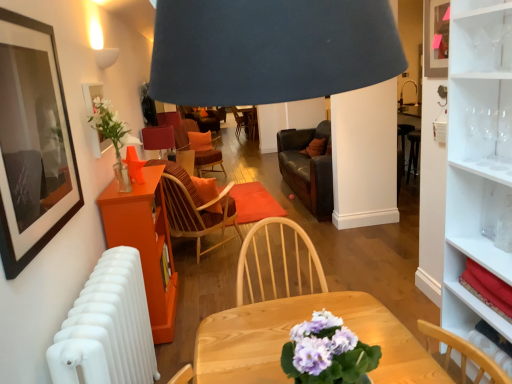
Question: Considering the positions of white matte radiator at lower left and matte red table lamp at center in the image, is white matte radiator at lower left wider or thinner than matte red table lamp at center?

Choices:
 (A) thin
 (B) wide

Answer: (A)

Question: Based on their sizes in the image, would you say white matte radiator at lower left is bigger or smaller than matte red table lamp at center?

Choices:
 (A) small
 (B) big

Answer: (B)

Question: Estimate the real-world distances between objects in this image. Which object is farther from the matte black picture frame at upper left, positioned as the 1th picture frame in front-to-back order?

Choices:
 (A) clear glass wine glass at upper right, acting as the first wine glass starting from the right
 (B) brown striped fabric chair at center, the first chair in the front-to-back sequence
 (C) matte glass picture frame at upper left, arranged as the first picture frame when viewed from the back
 (D) clear glass wine glass at upper right, marked as the first wine glass in a left-to-right arrangement
 (E) matte red table lamp at center

Answer: (E)

Question: Which object is positioned closest to the orange fabric chair at center, which appears as the 2th chair when viewed from the front?

Choices:
 (A) white matte radiator at lower left
 (B) clear glass wine glass at upper right, arranged as the third wine glass when viewed from the left
 (C) matte black picture frame at upper left, acting as the 1th picture frame starting from the right
 (D) orange wood table at left
 (E) matte glass picture frame at upper left, which appears as the second picture frame when viewed from the front

Answer: (D)